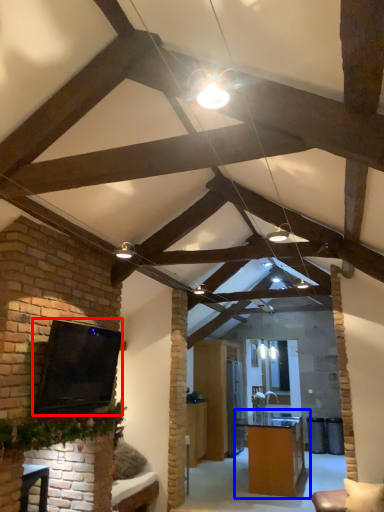
Question: Among these objects, which one is farthest to the camera, open (highlighted by a red box) or table (highlighted by a blue box)?

Choices:
 (A) open
 (B) table

Answer: (B)